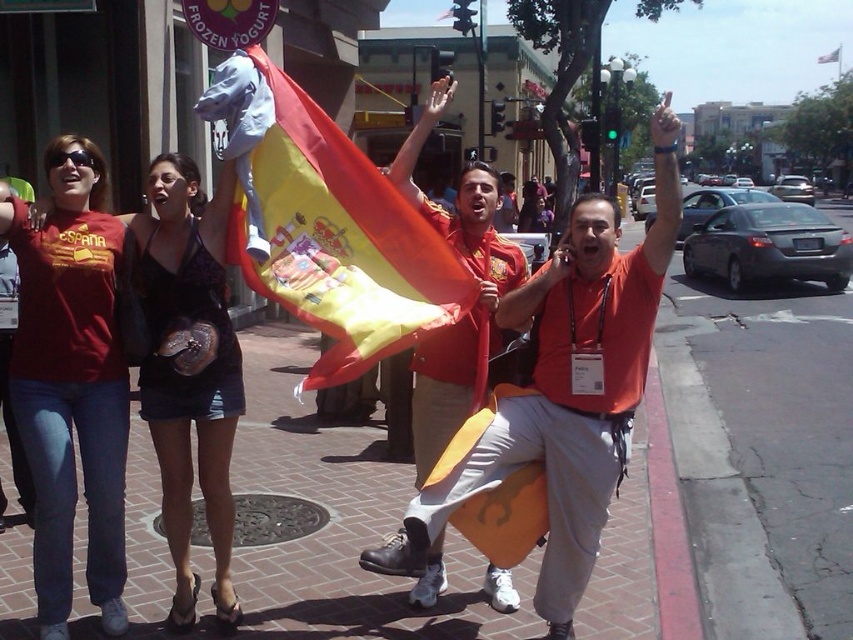
Locate an element on the screen. The image size is (853, 640). brick pavement at center is located at coordinates (340, 522).

Who is positioned more to the right, brick pavement at center or red/yellow fabric flag at center?

red/yellow fabric flag at center

Between point (619, 515) and point (314, 252), which one is positioned in front?

Point (314, 252)

The image size is (853, 640). Identify the location of brick pavement at center. (340, 522).

Between point (548, 385) and point (402, 214), which one is positioned in front?

Positioned in front is point (548, 385).

Does orange fabric flag at center lie behind red/yellow fabric flag at center?

No, it is not.

Find the location of `orange fabric flag at center`. orange fabric flag at center is located at coordinates (566, 390).

Is red/yellow fabric flag at center to the left of red fabric flag at center from the viewer's perspective?

Correct, you'll find red/yellow fabric flag at center to the left of red fabric flag at center.

Is red/yellow fabric flag at center wider than red fabric flag at center?

Indeed, red/yellow fabric flag at center has a greater width compared to red fabric flag at center.

This screenshot has height=640, width=853. What are the coordinates of `red/yellow fabric flag at center` in the screenshot? It's located at (328, 227).